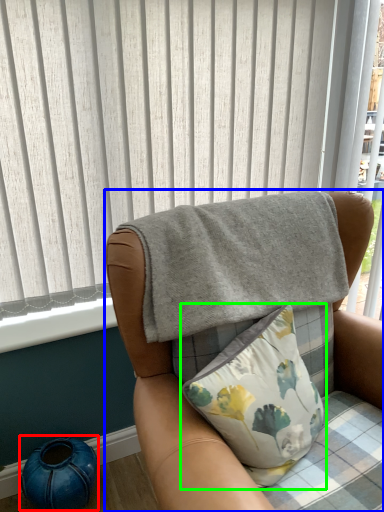
Question: Estimate the real-world distances between objects in this image. Which object is closer to teal (highlighted by a red box), chair (highlighted by a blue box) or pillow (highlighted by a green box)?

Choices:
 (A) chair
 (B) pillow

Answer: (A)